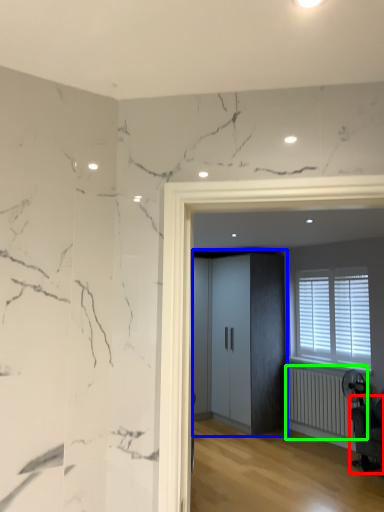
Question: Which object is the closest to the swivel chair (highlighted by a red box)? Choose among these: elevator (highlighted by a blue box) or radiator (highlighted by a green box).

Choices:
 (A) elevator
 (B) radiator

Answer: (B)